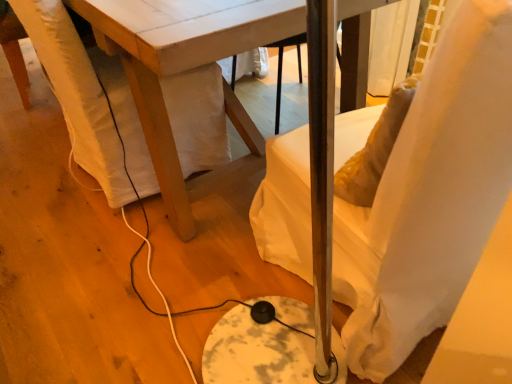
Describe the element at coordinates (430, 197) in the screenshot. The image size is (512, 384). I see `white fabric chair at right` at that location.

Where is `white wood table at center`? This screenshot has height=384, width=512. white wood table at center is located at coordinates (183, 71).

Is white fabric swivel chair at lower left in contact with white wood table at center?

No, white fabric swivel chair at lower left is not in contact with white wood table at center.

How different are the orientations of white fabric swivel chair at lower left and white wood table at center in degrees?

178 degrees.

Considering the relative sizes of white fabric swivel chair at lower left and white wood table at center in the image provided, is white fabric swivel chair at lower left thinner than white wood table at center?

Correct, the width of white fabric swivel chair at lower left is less than that of white wood table at center.

Which object is more forward, white fabric swivel chair at lower left or white wood table at center?

white wood table at center is more forward.

Based on the photo, which of these two, white fabric chair at right or white wood table at center, is bigger?

white wood table at center.

From a real-world perspective, relative to white wood table at center, is white fabric chair at right vertically above or below?

white fabric chair at right is above white wood table at center.

Is the depth of white fabric chair at right greater than that of white wood table at center?

No, it is in front of white wood table at center.

Is white fabric chair at right to the right of white wood table at center from the viewer's perspective?

Yes, white fabric chair at right is to the right of white wood table at center.

Is white fabric chair at right thinner than white fabric swivel chair at lower left?

No.

From the image's perspective, is white fabric chair at right over white fabric swivel chair at lower left?

No, from the image's perspective, white fabric chair at right is not on top of white fabric swivel chair at lower left.

Is white fabric chair at right far away from white fabric swivel chair at lower left?

They are positioned close to each other.

Could you tell me if white fabric chair at right is turned towards white fabric swivel chair at lower left?

No, white fabric chair at right is not facing towards white fabric swivel chair at lower left.

In the scene shown: Is white wood table at center positioned in front of white fabric swivel chair at lower left?

Yes, the depth of white wood table at center is less than that of white fabric swivel chair at lower left.

From a real-world perspective, between white wood table at center and white fabric swivel chair at lower left, who is vertically lower?

white fabric swivel chair at lower left.

Would you say white wood table at center is inside or outside white fabric swivel chair at lower left?

white wood table at center is located beyond the bounds of white fabric swivel chair at lower left.

Based on their sizes in the image, would you say white wood table at center is bigger or smaller than white fabric swivel chair at lower left?

Clearly, white wood table at center is larger in size than white fabric swivel chair at lower left.

Does white wood table at center have a lesser width compared to white fabric chair at right?

No.

Considering the relative sizes of white wood table at center and white fabric chair at right in the image provided, is white wood table at center bigger than white fabric chair at right?

Yes.

Are white wood table at center and white fabric chair at right located far from each other?

No, white wood table at center is not far from white fabric chair at right.

Between white wood table at center and white fabric chair at right, which one is positioned in front?

white fabric chair at right is closer to the camera.

From the image's perspective, between white fabric swivel chair at lower left and white fabric chair at right, who is located below?

white fabric chair at right.

Is white fabric swivel chair at lower left aimed at white fabric chair at right?

No, white fabric swivel chair at lower left is not turned towards white fabric chair at right.

Would you say white fabric swivel chair at lower left is a long distance from white fabric chair at right?

No, white fabric swivel chair at lower left is not far away from white fabric chair at right.

Identify the location of table on the right side of white fabric swivel chair at lower left. (183, 71).

Identify the location of table that is behind the white fabric chair at right. The width and height of the screenshot is (512, 384). (183, 71).

Which object lies further to the anchor point white fabric chair at right, white fabric swivel chair at lower left or white wood table at center?

white fabric swivel chair at lower left is positioned further to the anchor white fabric chair at right.

Based on their spatial positions, is white wood table at center or white fabric swivel chair at lower left closer to white fabric chair at right?

Based on the image, white wood table at center appears to be nearer to white fabric chair at right.

Looking at the image, which one is located further to white wood table at center, white fabric swivel chair at lower left or white fabric chair at right?

white fabric chair at right is further to white wood table at center.

When comparing their distances from white wood table at center, does white fabric chair at right or white fabric swivel chair at lower left seem closer?

white fabric swivel chair at lower left is closer to white wood table at center.

Considering their positions, is white wood table at center positioned closer to white fabric swivel chair at lower left than white fabric chair at right?

Based on the image, white wood table at center appears to be nearer to white fabric swivel chair at lower left.

Based on the photo, considering their positions, is white fabric chair at right positioned closer to white fabric swivel chair at lower left than white wood table at center?

white wood table at center is positioned closer to the anchor white fabric swivel chair at lower left.

Find the location of a particular element. table between white fabric swivel chair at lower left and white fabric chair at right is located at coordinates (183, 71).